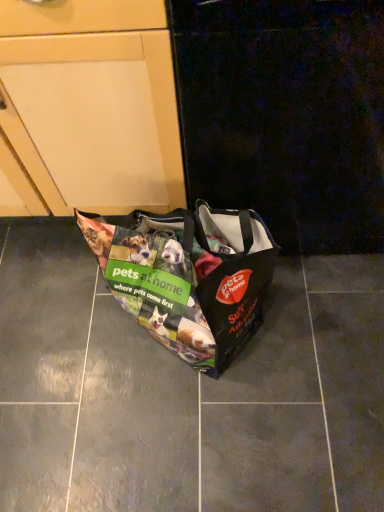
I want to click on free point to the right of polyester tote bag at center, so pyautogui.click(x=320, y=337).